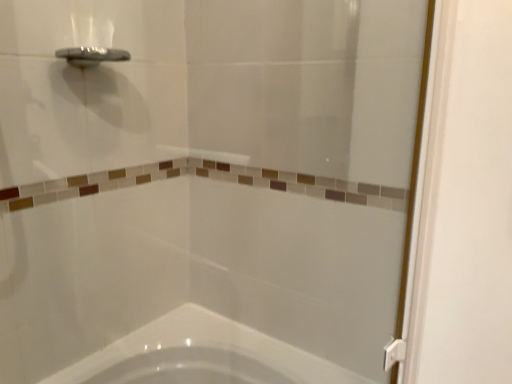
The height and width of the screenshot is (384, 512). Describe the element at coordinates (91, 55) in the screenshot. I see `satin nickel faucet at upper left` at that location.

Locate an element on the screen. This screenshot has width=512, height=384. satin nickel faucet at upper left is located at coordinates click(x=91, y=55).

The image size is (512, 384). In order to click on satin nickel faucet at upper left in this screenshot , I will do `click(91, 55)`.